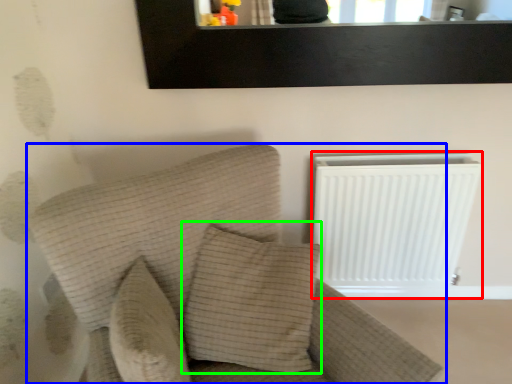
Question: Which object is positioned closest to radiator (highlighted by a red box)? Select from furniture (highlighted by a blue box) and pillow (highlighted by a green box).

Choices:
 (A) furniture
 (B) pillow

Answer: (B)